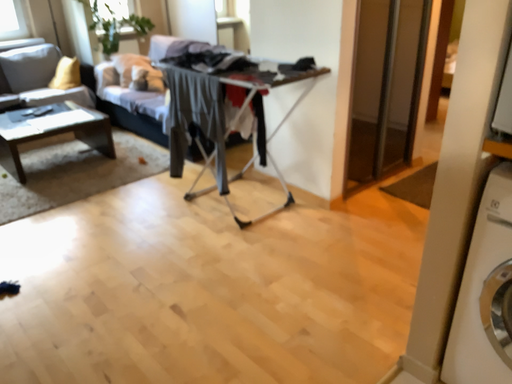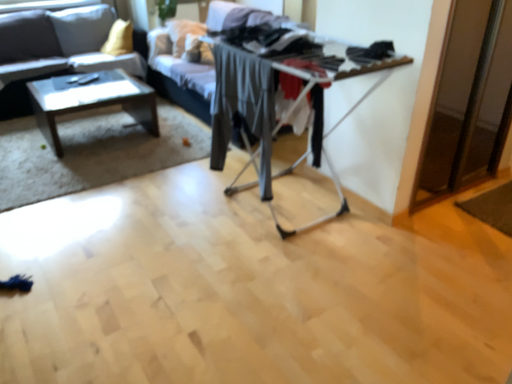
Question: Which way did the camera rotate in the video?

Choices:
 (A) rotated right
 (B) rotated left

Answer: (B)